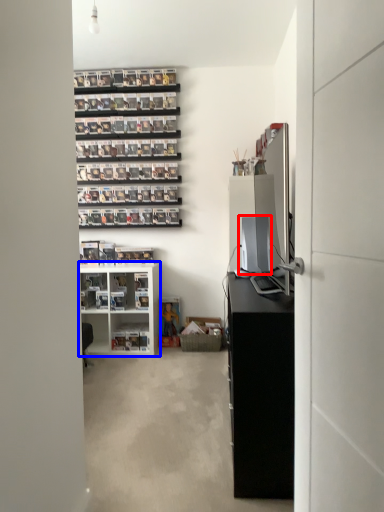
Question: Which point is closer to the camera, desktop computer (highlighted by a red box) or shelf (highlighted by a blue box)?

Choices:
 (A) desktop computer
 (B) shelf

Answer: (A)